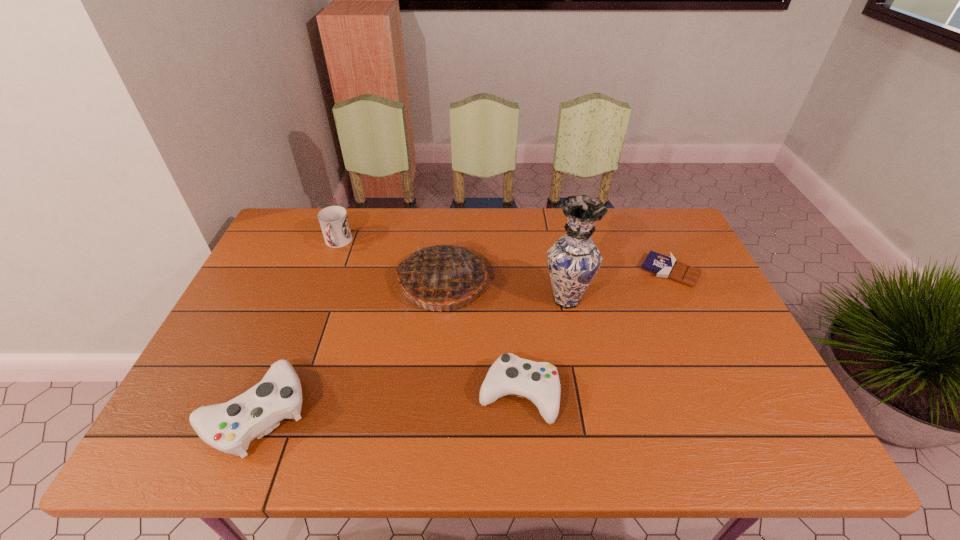
Find the location of `the fourth tallest object`. the fourth tallest object is located at coordinates (229, 427).

Where is `the taller control`? the taller control is located at coordinates (229, 427).

This screenshot has width=960, height=540. Identify the location of the fifth tallest object. (539, 382).

Identify the location of the right control. This screenshot has height=540, width=960. (539, 382).

In order to click on cup in this screenshot , I will do `click(333, 220)`.

Find the location of a particular element. The width and height of the screenshot is (960, 540). the second tallest object is located at coordinates (442, 275).

Where is `the shortest object`? the shortest object is located at coordinates (667, 267).

Identify the location of the rightmost object. This screenshot has width=960, height=540. (667, 267).

Find the location of `the tallest object`. the tallest object is located at coordinates (573, 260).

This screenshot has width=960, height=540. I want to click on vacant space positioned on the back of the third shortest object, so click(x=299, y=308).